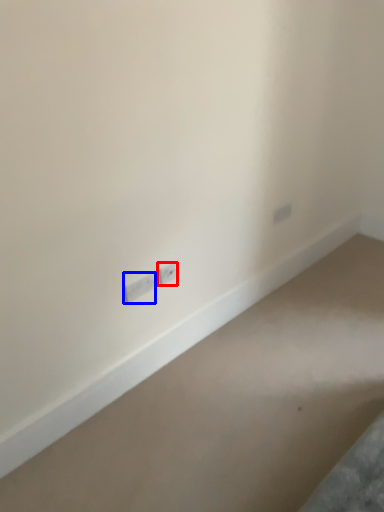
Question: Which object is further to the camera taking this photo, power plugs and sockets (highlighted by a red box) or power plugs and sockets (highlighted by a blue box)?

Choices:
 (A) power plugs and sockets
 (B) power plugs and sockets

Answer: (A)